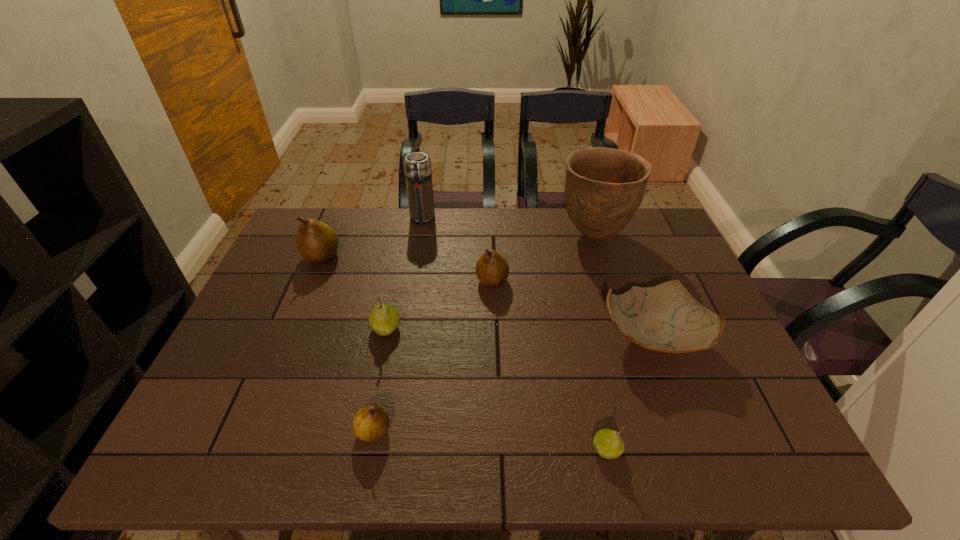
This screenshot has width=960, height=540. Find the location of `empty space that is in between the third nearest pear and the right green pear`. empty space that is in between the third nearest pear and the right green pear is located at coordinates (496, 389).

Point out which object is positioned as the sixth nearest to the nearer green pear. Please provide its 2D coordinates. Your answer should be formatted as a tuple, i.e. [(x, y)], where the tuple contains the x and y coordinates of a point satisfying the conditions above.

[(417, 166)]

In order to click on the second closest object to the left green pear in this screenshot , I will do `click(492, 269)`.

I want to click on pear that is the second closest one to the biggest brown pear, so click(492, 269).

Identify which pear is the third closest to the thermos bottle. Please provide its 2D coordinates. Your answer should be formatted as a tuple, i.e. [(x, y)], where the tuple contains the x and y coordinates of a point satisfying the conditions above.

[(384, 319)]

Locate an element on the screen. The image size is (960, 540). the closest brown pear to the thermos bottle is located at coordinates (317, 243).

The width and height of the screenshot is (960, 540). I want to click on brown pear that stands as the third closest to the right green pear, so click(317, 243).

In order to click on vacant space that satisfies the following two spatial constraints: 1. on the front side of the farther green pear; 2. on the left side of the rightmost pear in this screenshot , I will do `click(360, 450)`.

Locate an element on the screen. The width and height of the screenshot is (960, 540). free region that satisfies the following two spatial constraints: 1. with a handle on the side of the right green pear; 2. on the right side of the seventh shortest object is located at coordinates (383, 450).

Find the location of a particular element. The image size is (960, 540). free location that satisfies the following two spatial constraints: 1. with a handle on the side of the smaller green pear; 2. on the right side of the second tallest object is located at coordinates (383, 450).